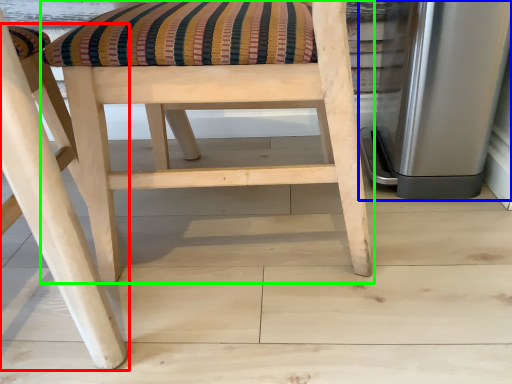
Question: Considering the real-world distances, which object is farthest from chair (highlighted by a red box)? appliance (highlighted by a blue box) or chair (highlighted by a green box)?

Choices:
 (A) appliance
 (B) chair

Answer: (A)